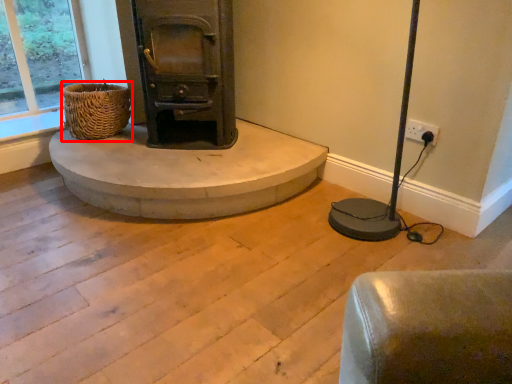
Question: From the image's perspective, what is the correct spatial positioning of basket (annotated by the red box) in reference to concrete?

Choices:
 (A) below
 (B) above

Answer: (B)